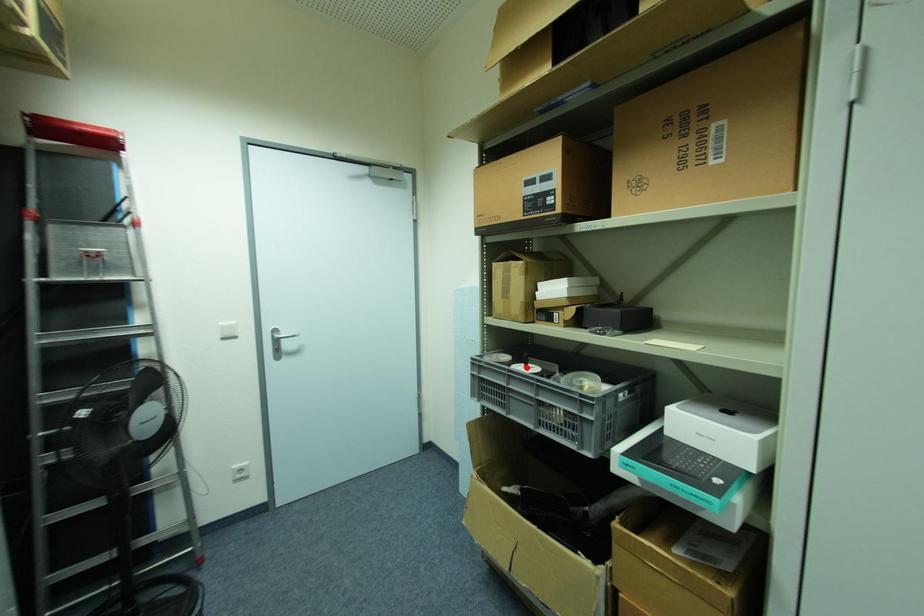
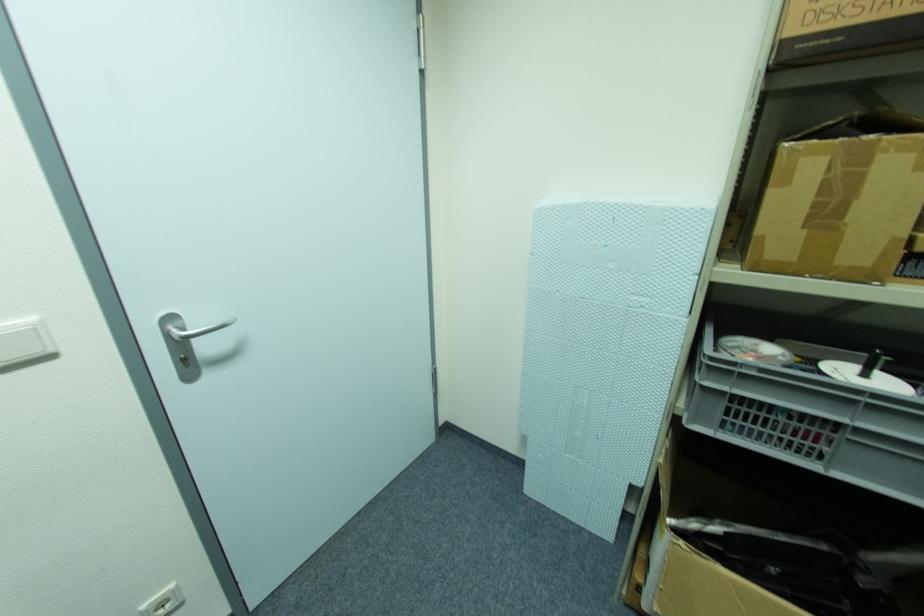
The point at the highlighted location is marked in the first image. Where is the corresponding point in the second image?

(867, 376)